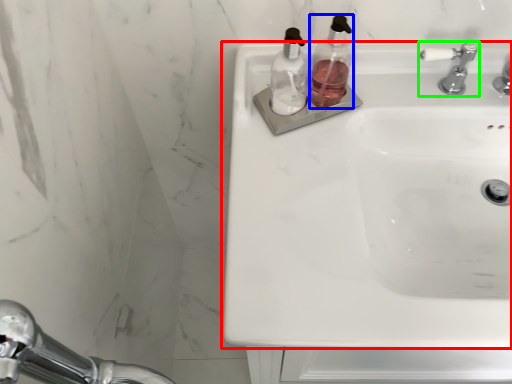
Question: Which object is positioned farthest from sink (highlighted by a red box)? Select from soap dispenser (highlighted by a blue box) and tap (highlighted by a green box).

Choices:
 (A) soap dispenser
 (B) tap

Answer: (B)